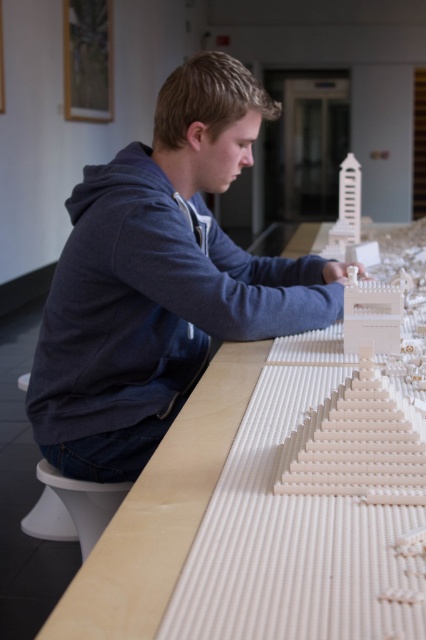
You are a guest in this room and want to sit down at the light brown wood table at center. However, there is a dark blue hoodie at center in the way. Can you move the hoodie to the right side of the table to make space?

The dark blue hoodie at center is already to the left of the light brown wood table at center, so moving it to the right side would require shifting it from its current position on the left to the right side of the table, which is possible to create more space.

You are a photographer standing behind the dark blue hoodie at center and the light brown wood table at center. You want to take a photo of the LEGO model without any obstructions. Which object should you move to ensure the LEGO model is fully visible?

The dark blue hoodie at center is below the light brown wood table at center, so you should move the dark blue hoodie at center to ensure the LEGO model is fully visible.

You are a photographer trying to capture the LEGO model from above. You notice the dark blue hoodie at center and the light brown wood table at center. Which object is taller and might block your view of the LEGO model?

The dark blue hoodie at center is taller than the light brown wood table at center, so it might block the view of the LEGO model.